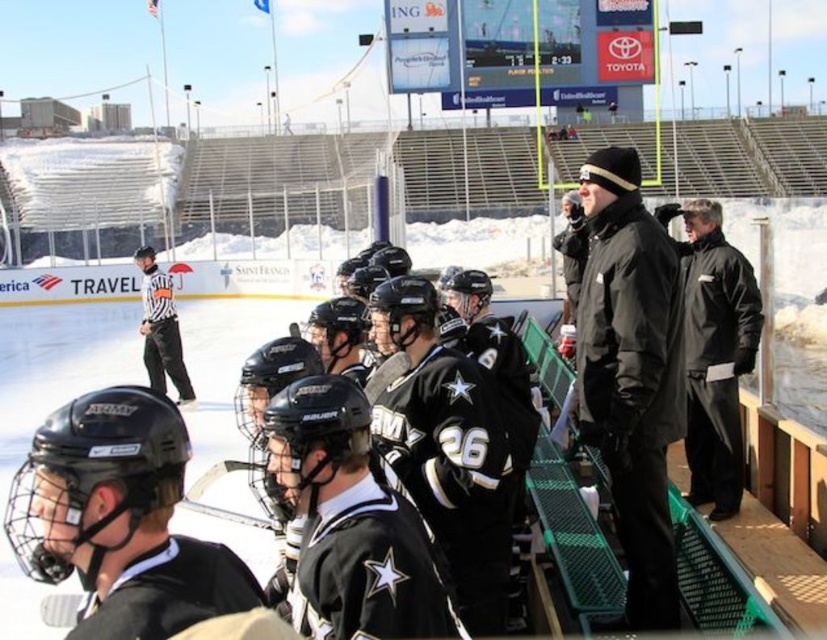
Who is taller, black matte jacket at upper right or black matte jacket at right?

black matte jacket at right

Is black matte jacket at upper right smaller than black matte jacket at right?

Correct, black matte jacket at upper right occupies less space than black matte jacket at right.

Where is `black matte jacket at upper right`? Image resolution: width=827 pixels, height=640 pixels. black matte jacket at upper right is located at coordinates (630, 372).

Which is above, black matte hockey helmets at center or black matte jacket at right?

black matte hockey helmets at center is higher up.

Between point (221, 502) and point (686, 218), which one is positioned behind?

The point (221, 502) is more distant.

The image size is (827, 640). What are the coordinates of `black matte hockey helmets at center` in the screenshot? It's located at (56, 364).

Can you confirm if black matte hockey helmets at center is taller than black mesh referee at center?

Indeed, black matte hockey helmets at center has a greater height compared to black mesh referee at center.

Is point (32, 365) positioned after point (134, 257)?

Yes, it is.

Where is `black matte hockey helmets at center`? The image size is (827, 640). black matte hockey helmets at center is located at coordinates (56, 364).